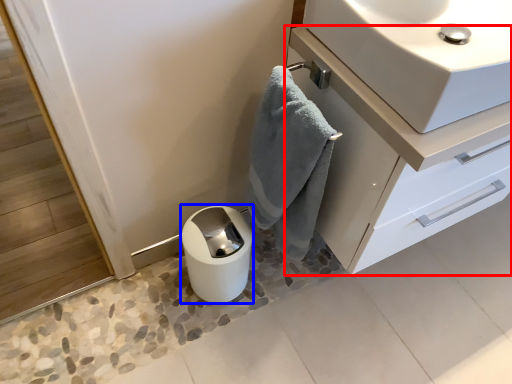
Question: Which of the following is the closest to the observer, bathroom cabinet (highlighted by a red box) or paper towel (highlighted by a blue box)?

Choices:
 (A) bathroom cabinet
 (B) paper towel

Answer: (A)